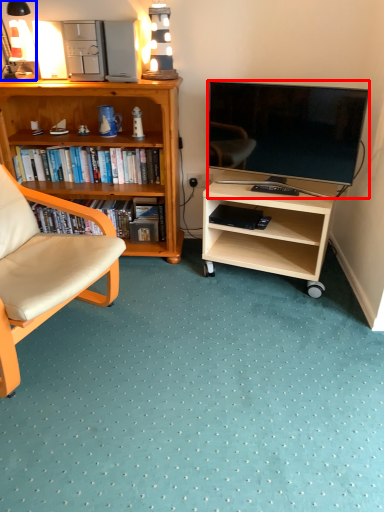
Question: Among these objects, which one is farthest to the camera, television (highlighted by a red box) or lamp (highlighted by a blue box)?

Choices:
 (A) television
 (B) lamp

Answer: (B)